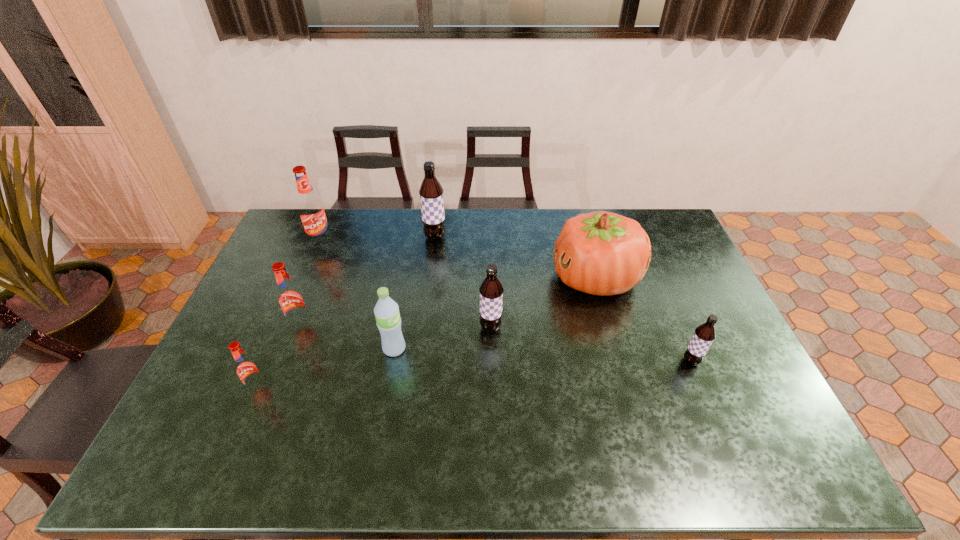
Locate an element on the screen. vacant area that lies between the rightmost object and the green pumpkin is located at coordinates click(643, 320).

Identify which object is the second closest to the second biggest red root beer. Please provide its 2D coordinates. Your answer should be formatted as a tuple, i.e. [(x, y)], where the tuple contains the x and y coordinates of a point satisfying the conditions above.

[(388, 320)]

Identify which object is the second nearest to the second farthest red root beer. Please provide its 2D coordinates. Your answer should be formatted as a tuple, i.e. [(x, y)], where the tuple contains the x and y coordinates of a point satisfying the conditions above.

[(388, 320)]

Identify which root beer is the closest to the pumpkin. Please provide its 2D coordinates. Your answer should be formatted as a tuple, i.e. [(x, y)], where the tuple contains the x and y coordinates of a point satisfying the conditions above.

[(704, 334)]

Identify which root beer is the fifth closest to the green water bottle. Please provide its 2D coordinates. Your answer should be formatted as a tuple, i.e. [(x, y)], where the tuple contains the x and y coordinates of a point satisfying the conditions above.

[(311, 210)]

Choose which red root beer is the nearest neighbor to the nearest red root beer. Please provide its 2D coordinates. Your answer should be formatted as a tuple, i.e. [(x, y)], where the tuple contains the x and y coordinates of a point satisfying the conditions above.

[(290, 297)]

Where is `red root beer that is the third closest one to the rightmost root beer`? Image resolution: width=960 pixels, height=540 pixels. red root beer that is the third closest one to the rightmost root beer is located at coordinates (311, 210).

The image size is (960, 540). Identify the location of brown root beer that is the third nearest to the second smallest red root beer. (704, 334).

Select which brown root beer is the closest to the pumpkin. Please provide its 2D coordinates. Your answer should be formatted as a tuple, i.e. [(x, y)], where the tuple contains the x and y coordinates of a point satisfying the conditions above.

[(704, 334)]

Locate an element on the screen. vacant space that satisfies the following two spatial constraints: 1. on the back side of the nearest root beer; 2. on the left side of the fifth root beer from left to right is located at coordinates (284, 328).